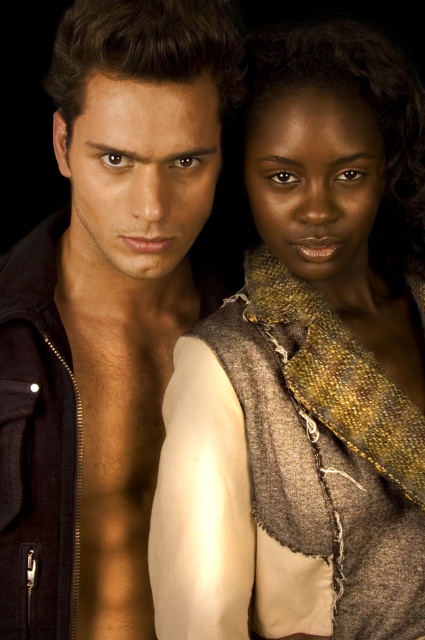
Is textured brown scarf at center positioned at the back of matte black jacket at left?

That is True.

Find the location of a particular element. This screenshot has height=640, width=425. textured brown scarf at center is located at coordinates (306, 368).